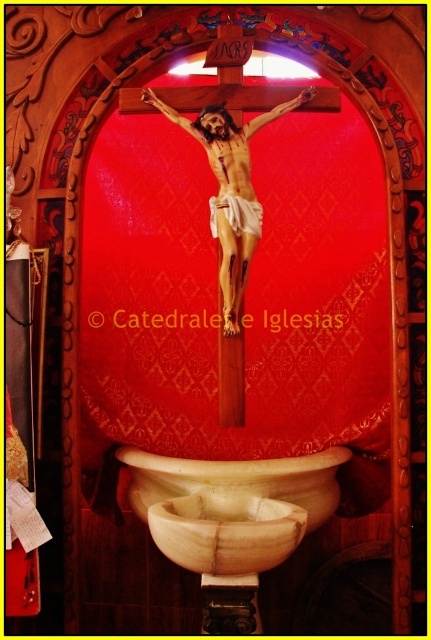
Is white marble basin at lower center smaller than white marble sink at lower center?

Yes, white marble basin at lower center is smaller than white marble sink at lower center.

Can you confirm if white marble basin at lower center is positioned below white marble sink at lower center?

Yes, white marble basin at lower center is below white marble sink at lower center.

Is point (219, 545) positioned after point (266, 477)?

No, it is not.

You are a GUI agent. You are given a task and a screenshot of the screen. Output one action in this format:
    pyautogui.click(x=<x>, y=<y>)
    Task: Click on the white marble basin at lower center
    The height and width of the screenshot is (640, 431).
    Given the screenshot: What is the action you would take?
    pyautogui.click(x=225, y=531)